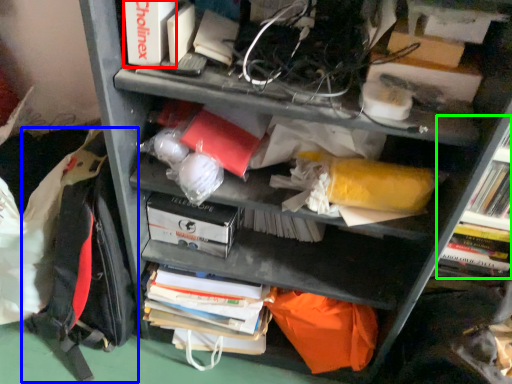
Question: Which object is the farthest from paperback book (highlighted by a red box)? Choose among these: backpack (highlighted by a blue box) or shelf (highlighted by a green box).

Choices:
 (A) backpack
 (B) shelf

Answer: (B)